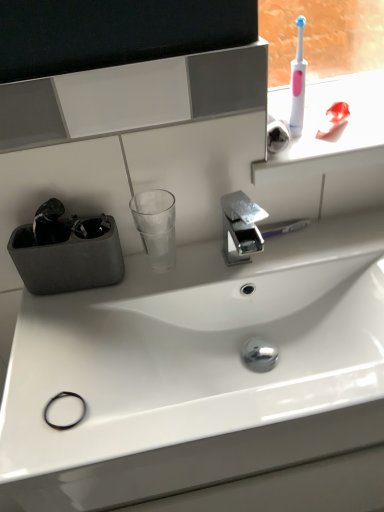
Question: Does pink plastic toothbrush at upper right have a greater height compared to transparent glass at center?

Choices:
 (A) yes
 (B) no

Answer: (B)

Question: From the image's perspective, would you say pink plastic toothbrush at upper right is positioned over transparent glass at center?

Choices:
 (A) yes
 (B) no

Answer: (A)

Question: Is pink plastic toothbrush at upper right not near transparent glass at center?

Choices:
 (A) yes
 (B) no

Answer: (B)

Question: Can you confirm if pink plastic toothbrush at upper right is positioned to the left of transparent glass at center?

Choices:
 (A) no
 (B) yes

Answer: (A)

Question: Does pink plastic toothbrush at upper right have a greater width compared to transparent glass at center?

Choices:
 (A) no
 (B) yes

Answer: (B)

Question: From the image's perspective, does pink plastic toothbrush at upper right appear lower than transparent glass at center?

Choices:
 (A) no
 (B) yes

Answer: (A)

Question: From the image's perspective, is white plastic toothbrush at upper right below pink plastic toothbrush at upper right?

Choices:
 (A) no
 (B) yes

Answer: (A)

Question: Is white plastic toothbrush at upper right thinner than pink plastic toothbrush at upper right?

Choices:
 (A) yes
 (B) no

Answer: (A)

Question: From a real-world perspective, is white plastic toothbrush at upper right located higher than pink plastic toothbrush at upper right?

Choices:
 (A) no
 (B) yes

Answer: (B)

Question: Is white plastic toothbrush at upper right smaller than pink plastic toothbrush at upper right?

Choices:
 (A) yes
 (B) no

Answer: (A)

Question: Is white plastic toothbrush at upper right closer to camera compared to pink plastic toothbrush at upper right?

Choices:
 (A) yes
 (B) no

Answer: (A)

Question: Is white plastic toothbrush at upper right wider than pink plastic toothbrush at upper right?

Choices:
 (A) yes
 (B) no

Answer: (B)

Question: Is transparent glass at center oriented away from pink plastic toothbrush at upper right?

Choices:
 (A) no
 (B) yes

Answer: (A)